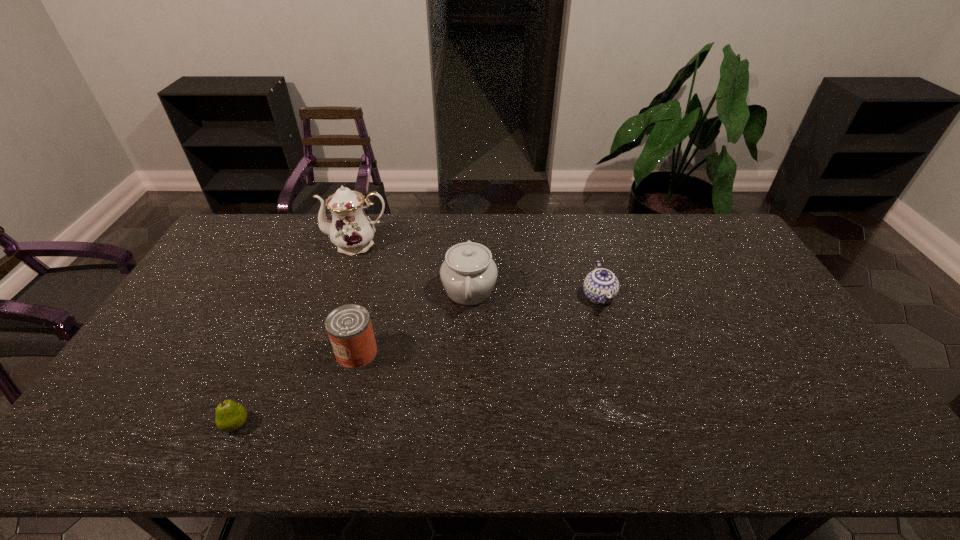
At what (x,y) coordinates should I click in order to perform the action: click on vacant space positioned 0.350m on the front of the fourth object from left to right. Please return your answer as a coordinate pair (x, y). The image size is (960, 540). Looking at the image, I should click on (466, 425).

Where is `vacant space located 0.210m on the left of the can`? vacant space located 0.210m on the left of the can is located at coordinates (260, 354).

This screenshot has height=540, width=960. Find the location of `vacant region located 0.270m at the spout of the shortest chinaware`. vacant region located 0.270m at the spout of the shortest chinaware is located at coordinates (627, 395).

At what (x,y) coordinates should I click in order to perform the action: click on free space located 0.370m on the back of the pear. Please return your answer as a coordinate pair (x, y). This screenshot has width=960, height=540. Looking at the image, I should click on (290, 305).

Where is `object located in the far edge section of the desktop`? This screenshot has height=540, width=960. object located in the far edge section of the desktop is located at coordinates (350, 229).

Locate an element on the screen. Image resolution: width=960 pixels, height=540 pixels. object that is at the near edge is located at coordinates (230, 416).

The height and width of the screenshot is (540, 960). In the image, there is a desktop. Identify the location of vacant space at the far edge. (400, 244).

At what (x,y) coordinates should I click in order to perform the action: click on free space at the near edge. Please return your answer as a coordinate pair (x, y). The height and width of the screenshot is (540, 960). Looking at the image, I should click on (188, 435).

Where is `free space at the left edge of the desktop`? free space at the left edge of the desktop is located at coordinates (223, 267).

Where is `vacant space at the right edge`? This screenshot has height=540, width=960. vacant space at the right edge is located at coordinates (751, 318).